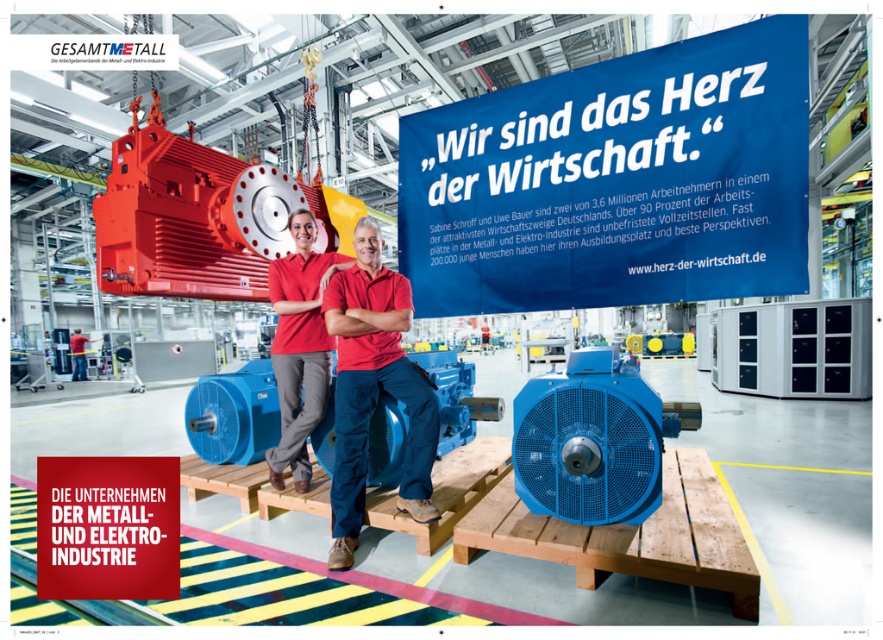
What is the spatial relationship between the red fabric shirt at center and the red smooth shirt at center?

The red fabric shirt at center is located below the red smooth shirt at center.

Consider the image. What are the coordinates of the red fabric shirt at center?

The coordinates of the red fabric shirt at center are at point [374,388].

You are a quality control inspector in the factory. You need to check the size of the red fabric shirt at center and the red smooth shirt at center. Which one is bigger?

The red fabric shirt at center is larger in size compared to the red smooth shirt at center.